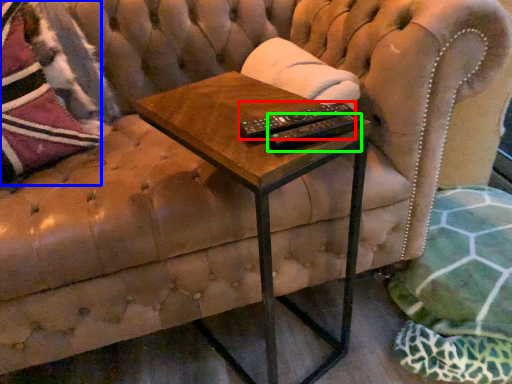
Question: Which object is positioned closest to control (highlighted by a red box)? Select from throw pillow (highlighted by a blue box) and remote (highlighted by a green box).

Choices:
 (A) throw pillow
 (B) remote

Answer: (B)